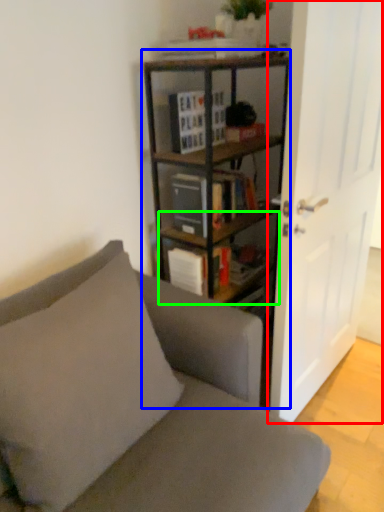
Question: Based on their relative distances, which object is farther from door (highlighted by a red box)? Choose from bookcase (highlighted by a blue box) and shelf (highlighted by a green box).

Choices:
 (A) bookcase
 (B) shelf

Answer: (B)